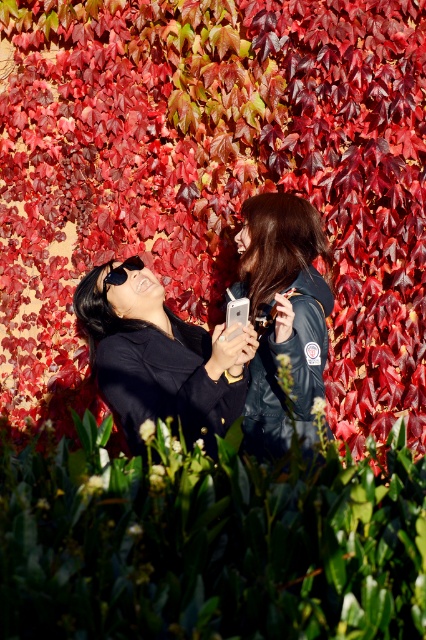
You are a photographer trying to capture a photo of the shiny red leaves at upper center and the matte black jacket at center. Based on their positions, which object is higher in the image?

The shiny red leaves at upper center are higher in the image than the matte black jacket at center because they are taller.

You are a photographer trying to capture a photo of the dark green leather jacket at center without the shiny red leaves at upper center blocking it. What adjustment can you make to your camera angle to achieve this?

Lower your camera angle so that the dark green leather jacket at center is framed below the shiny red leaves at upper center, which are positioned over it. This way, the jacket will be visible without the leaves obstructing it.

You are a photographer trying to capture a balanced composition. You notice the matte black jacket at center and the dark green leather jacket at center. Which jacket should you adjust to ensure both are equally visible in the frame?

The matte black jacket at center has a lesser height compared to dark green leather jacket at center, so you should lower the dark green leather jacket at center to match the height of the matte black jacket at center for balance.